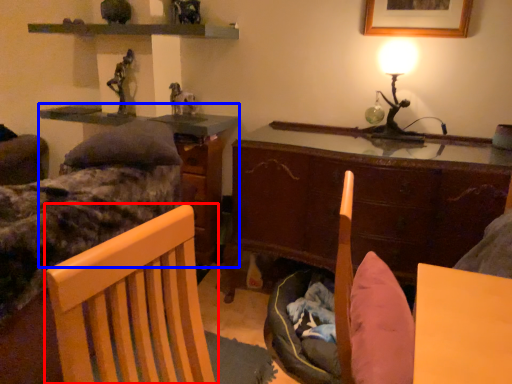
Question: Which object appears farthest to the camera in this image, chair (highlighted by a red box) or table (highlighted by a blue box)?

Choices:
 (A) chair
 (B) table

Answer: (B)